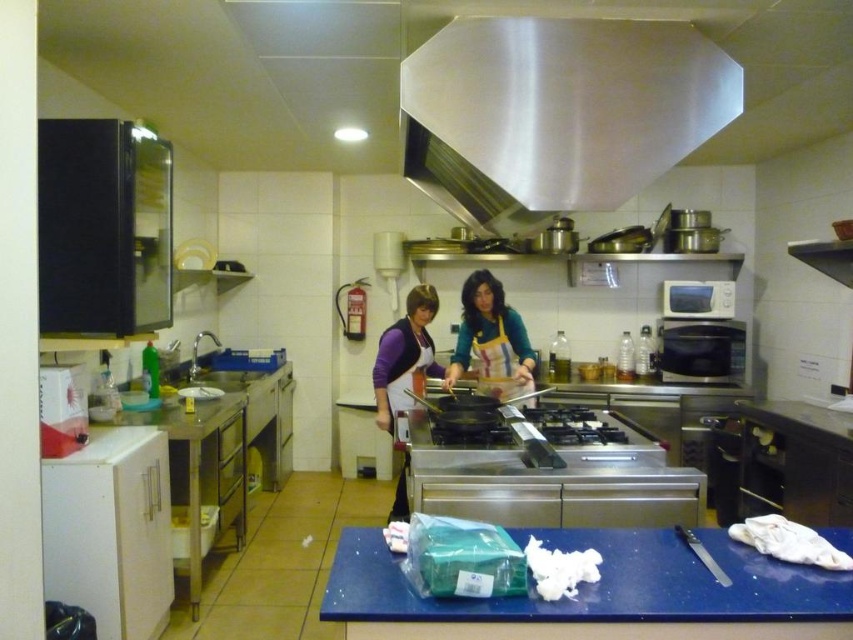
You are a chef in a commercial kitchen and need to cut vegetables on a surface. You have the blue plastic cutting board at lower center and the yellow apron at center. Which object can you use for cutting vegetables?

The blue plastic cutting board at lower center can be used for cutting vegetables since it is a cutting board and the yellow apron at center is meant to be worn for protection.

You are a new chef entering the kitchen and need to locate the purple fabric apron at center and the satin silver exhaust hood at upper center. Based on their positions, which object is closer to the right side of the kitchen?

The satin silver exhaust hood at upper center is positioned on the right side of purple fabric apron at center, so it is closer to the right side of the kitchen.